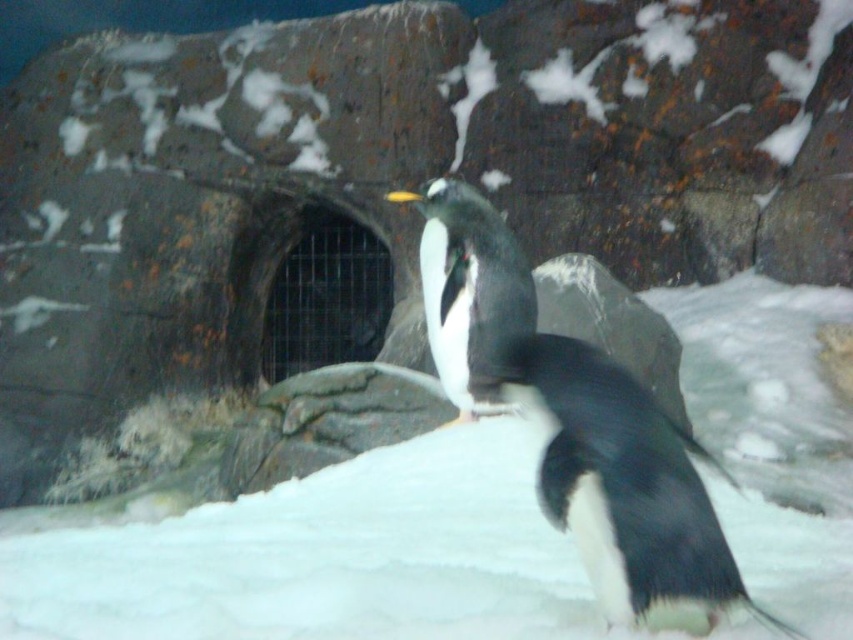
Question: Which point appears closest to the camera in this image?

Choices:
 (A) (824, 440)
 (B) (473, 211)

Answer: (B)

Question: Which object appears farthest from the camera in this image?

Choices:
 (A) white fluffy snow at center
 (B) black matte penguin at center

Answer: (A)

Question: Which object is the closest to the white fluffy snow at center?

Choices:
 (A) white matte penguin at center
 (B) black matte penguin at center

Answer: (A)

Question: Is white fluffy snow at center wider than white matte penguin at center?

Choices:
 (A) no
 (B) yes

Answer: (B)

Question: Does white fluffy snow at center appear over white matte penguin at center?

Choices:
 (A) yes
 (B) no

Answer: (B)

Question: Does white fluffy snow at center appear on the left side of white matte penguin at center?

Choices:
 (A) yes
 (B) no

Answer: (B)